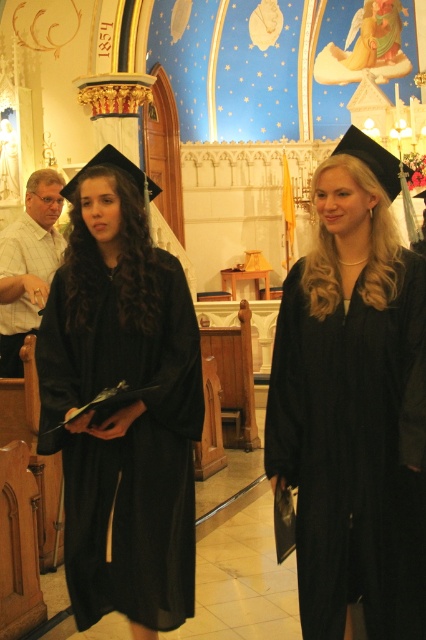
Is matte black graduation gown at center to the right of white checkered shirt at left from the viewer's perspective?

Yes, matte black graduation gown at center is to the right of white checkered shirt at left.

Can you confirm if matte black graduation gown at center is thinner than white checkered shirt at left?

No, matte black graduation gown at center is not thinner than white checkered shirt at left.

The width and height of the screenshot is (426, 640). What do you see at coordinates (354, 403) in the screenshot?
I see `matte black graduation gown at center` at bounding box center [354, 403].

I want to click on matte black graduation gown at center, so click(x=354, y=403).

Is matte black gown at left positioned before white checkered shirt at left?

Yes.

Looking at this image, who is shorter, matte black gown at left or white checkered shirt at left?

With less height is white checkered shirt at left.

The image size is (426, 640). Find the location of `matte black gown at left`. matte black gown at left is located at coordinates (123, 408).

This screenshot has width=426, height=640. What are the coordinates of `matte black gown at left` in the screenshot? It's located at (123, 408).

Image resolution: width=426 pixels, height=640 pixels. Describe the element at coordinates (354, 403) in the screenshot. I see `matte black graduation gown at center` at that location.

Who is more forward, (368, 460) or (92, 419)?

Point (368, 460)

Who is more forward, (417, 422) or (158, 604)?

Point (417, 422)

Find the location of a particular element. The image size is (426, 640). matte black graduation gown at center is located at coordinates (354, 403).